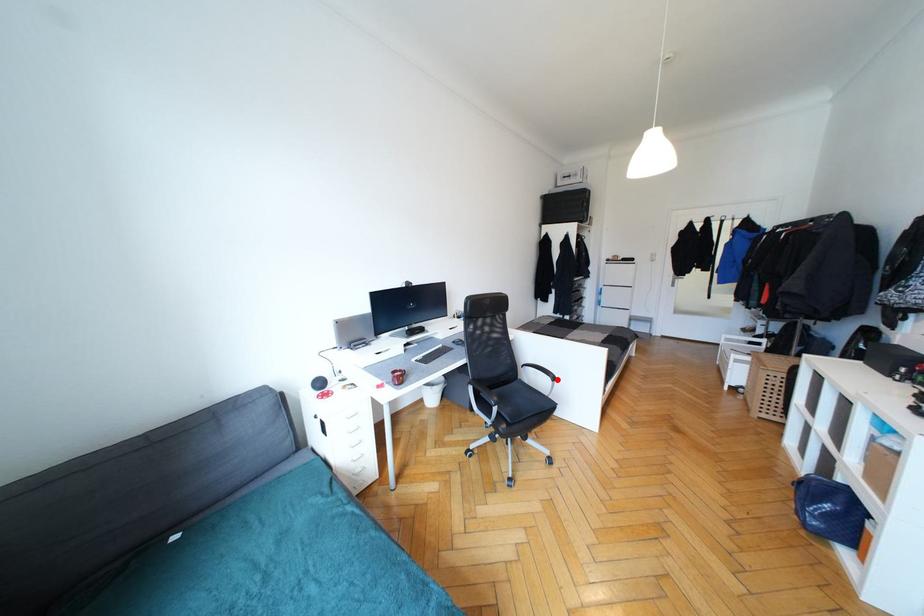
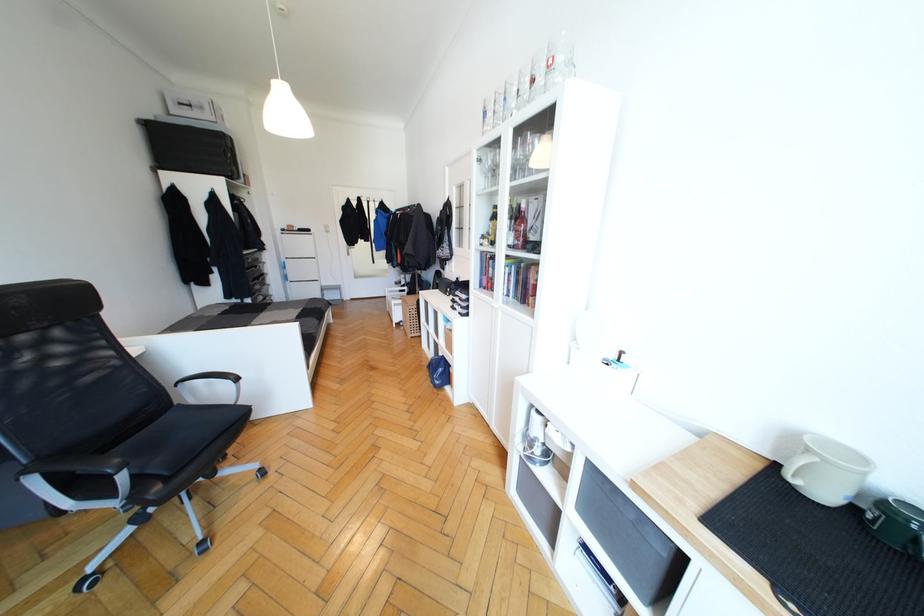
Where in the second image is the point corresponding to the highlighted location from the first image?

(239, 379)